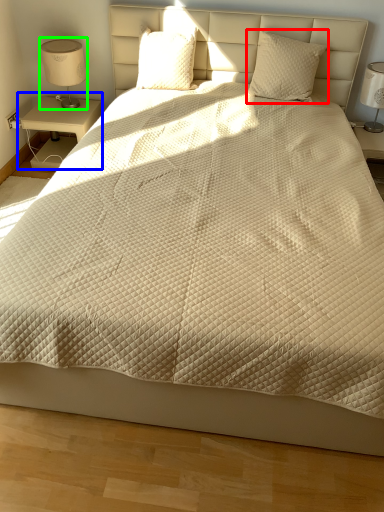
Question: Estimate the real-world distances between objects in this image. Which object is farther from pillow (highlighted by a red box), nightstand (highlighted by a blue box) or table lamp (highlighted by a green box)?

Choices:
 (A) nightstand
 (B) table lamp

Answer: (B)